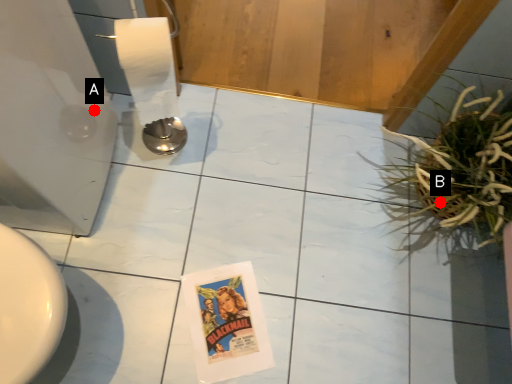
Question: Two points are circled on the image, labeled by A and B beside each circle. Among these points, which one is nearest to the camera?

Choices:
 (A) A is closer
 (B) B is closer

Answer: (B)